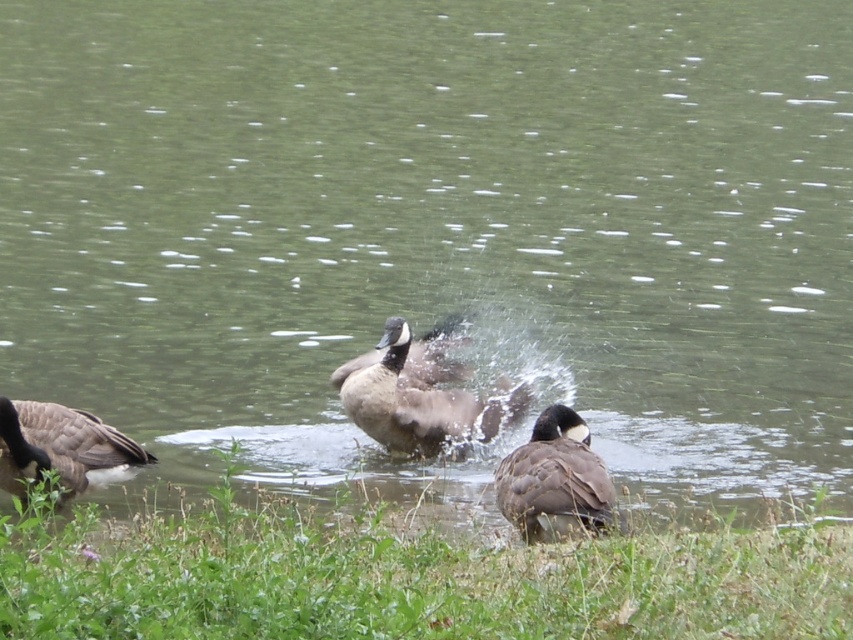
Question: Is brown matte duck at center bigger than brown feathered duck at lower right?

Choices:
 (A) yes
 (B) no

Answer: (A)

Question: Which point appears farthest from the camera in this image?

Choices:
 (A) (387, 547)
 (B) (103, 456)

Answer: (B)

Question: Which point is closer to the camera?

Choices:
 (A) brown feathered duck at lower right
 (B) brown feathered duck at lower left
 (C) green leafy grass at lower center

Answer: (C)

Question: Considering the real-world distances, which object is closest to the brown matte duck at center?

Choices:
 (A) brown feathered duck at lower left
 (B) brown feathered duck at lower right

Answer: (B)

Question: Can you confirm if brown feathered duck at lower right is positioned to the left of brown feathered duck at center?

Choices:
 (A) yes
 (B) no

Answer: (B)

Question: Is brown feathered duck at lower left below brown feathered duck at center?

Choices:
 (A) yes
 (B) no

Answer: (A)